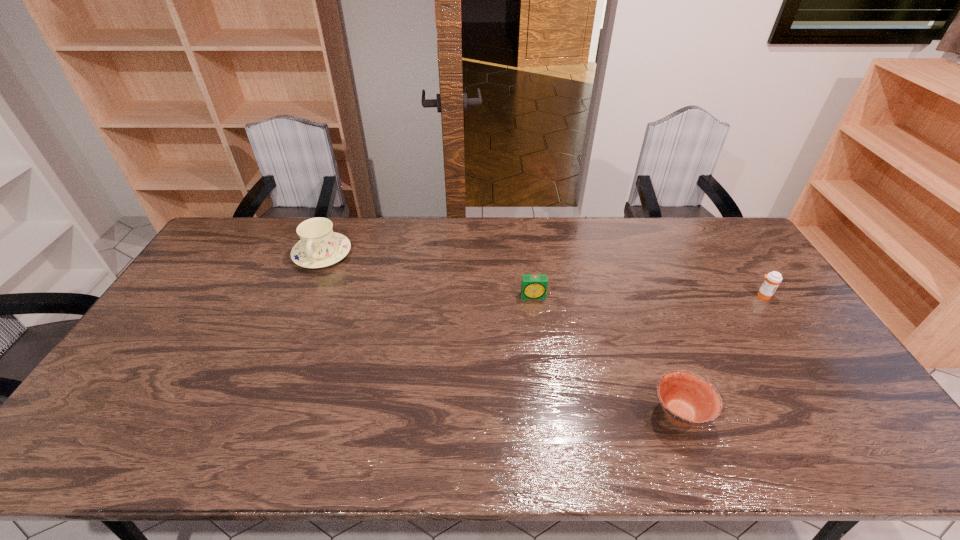
I want to click on chinaware, so click(319, 246).

I want to click on the farthest object, so click(x=319, y=246).

Locate an element on the screen. medicine is located at coordinates (773, 279).

This screenshot has height=540, width=960. I want to click on the second object from left to right, so click(x=533, y=287).

This screenshot has height=540, width=960. Identify the location of bowl. (687, 399).

Where is `the nearest object`? The width and height of the screenshot is (960, 540). the nearest object is located at coordinates (687, 399).

Where is `free space located 0.210m on the handle side of the tallest object`? free space located 0.210m on the handle side of the tallest object is located at coordinates (295, 319).

Where is `free space located 0.270m on the left of the rightmost object`? This screenshot has height=540, width=960. free space located 0.270m on the left of the rightmost object is located at coordinates (670, 295).

Where is `vacant space located on the front-facing side of the alarm clock`? The height and width of the screenshot is (540, 960). vacant space located on the front-facing side of the alarm clock is located at coordinates tap(541, 359).

What are the coordinates of `vacant space located on the back of the third object from left to right` in the screenshot? It's located at pyautogui.click(x=660, y=362).